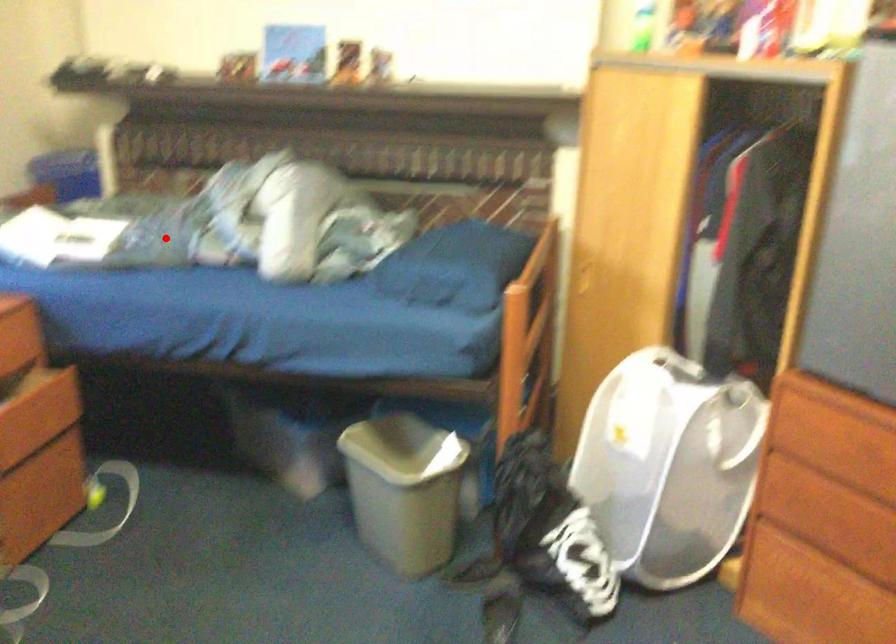
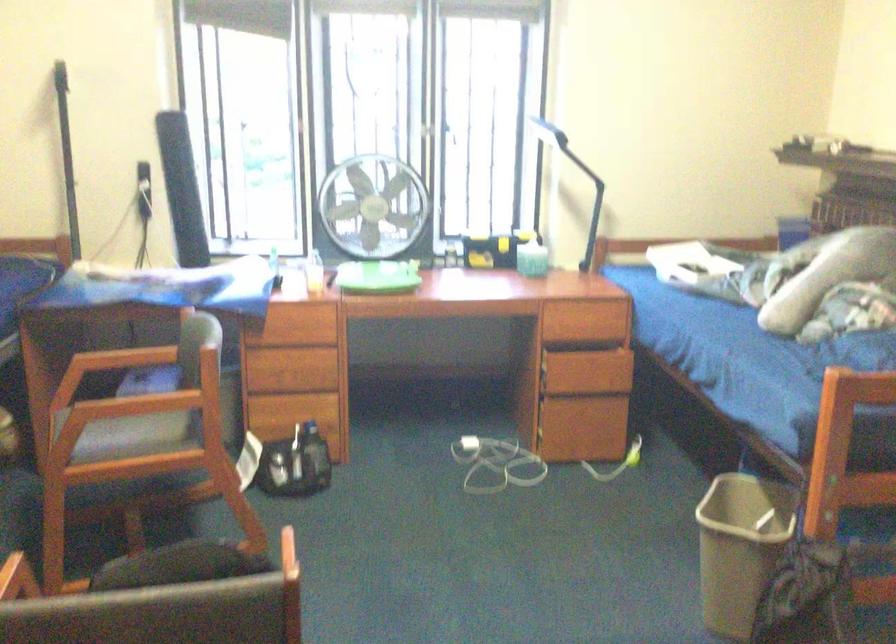
In the second image, find the point that corresponds to the highlighted location in the first image.

(745, 275)